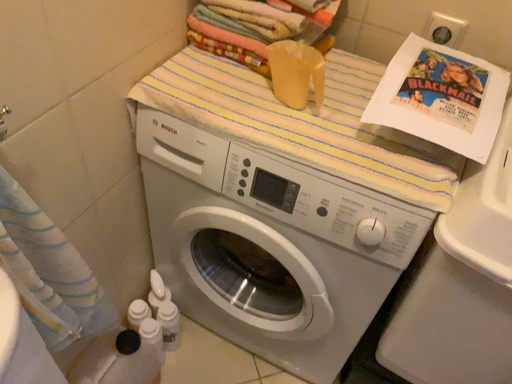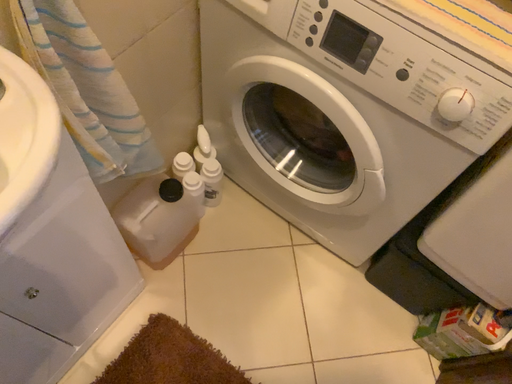
Question: How did the camera likely rotate when shooting the video?

Choices:
 (A) rotated downward
 (B) rotated upward

Answer: (A)